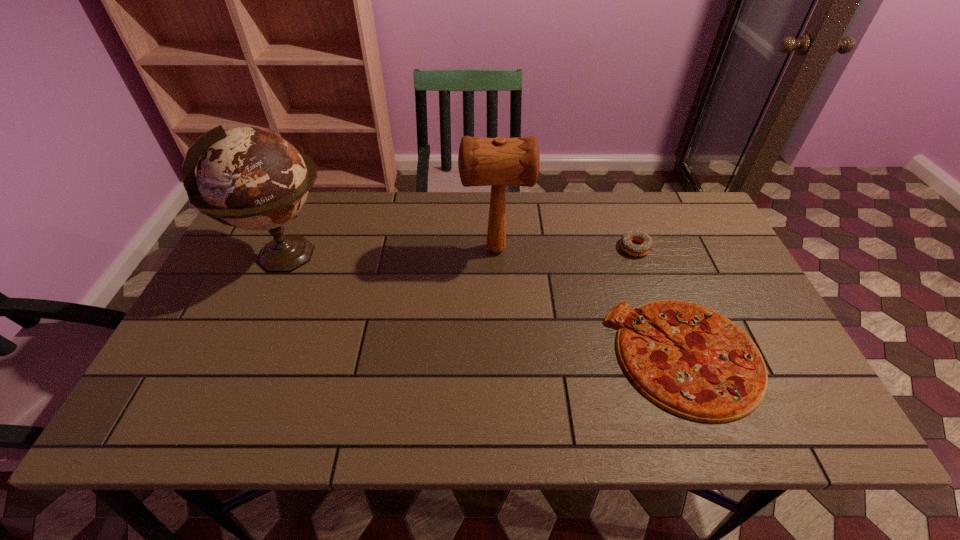
In the image, there is a desktop. Where is `vacant area at the far edge`? This screenshot has width=960, height=540. vacant area at the far edge is located at coordinates (420, 238).

Where is `free spot at the near edge of the desktop`? This screenshot has height=540, width=960. free spot at the near edge of the desktop is located at coordinates (275, 429).

You are a GUI agent. You are given a task and a screenshot of the screen. Output one action in this format:
    pyautogui.click(x=<x>, y=<y>)
    Task: Click on the vacant region at the left edge of the desktop
    This screenshot has height=540, width=960.
    Given the screenshot: What is the action you would take?
    coord(247,247)

Locate an element on the screen. This screenshot has width=960, height=540. free space at the right edge of the desktop is located at coordinates (689, 286).

The height and width of the screenshot is (540, 960). I want to click on vacant space at the far left corner of the desktop, so click(242, 237).

Identify the location of vacant space at the far right corner of the desktop. This screenshot has width=960, height=540. (697, 222).

Image resolution: width=960 pixels, height=540 pixels. Find the location of `free space between the globe and the shortest object`. free space between the globe and the shortest object is located at coordinates (486, 306).

In order to click on empty space that is in between the third object from right to left and the pizza in this screenshot , I will do `click(590, 302)`.

Where is `vacant area that lies between the leftmost object and the third tallest object`? The image size is (960, 540). vacant area that lies between the leftmost object and the third tallest object is located at coordinates (461, 252).

Locate an element on the screen. vacant area that lies between the globe and the doughnut is located at coordinates (461, 252).